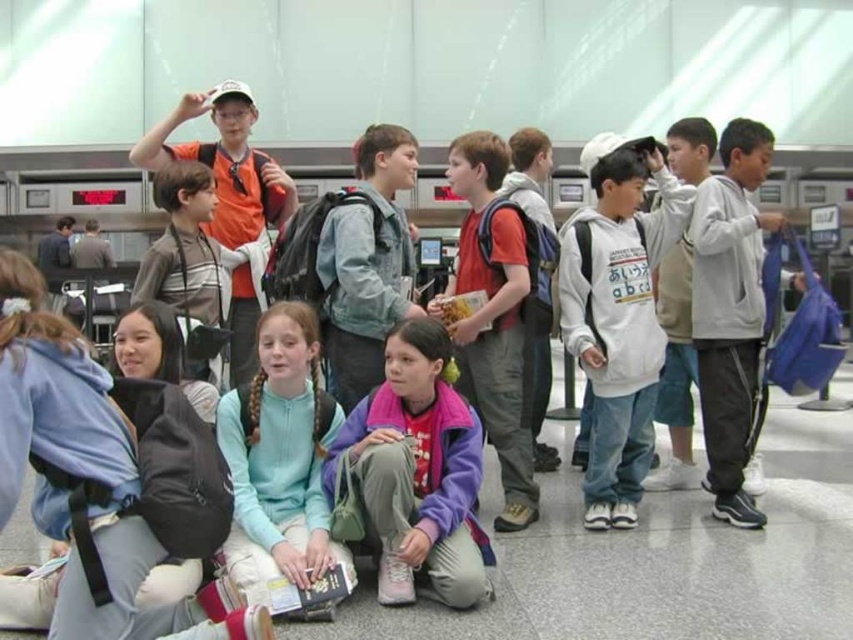
You are a parent looking for your child who is wearing a white cotton hoodie at center and a light blue fleece jacket at center. You see both items in the foreground. Which clothing item is covering the other?

The white cotton hoodie at center is positioned over the light blue fleece jacket at center, so the hoodie is covering the jacket.

You are a parent trying to locate your child who is wearing a white cotton hoodie at center. You see another child wearing a purple fleece jacket at center. How far apart are these two children?

The distance between the white cotton hoodie at center and the purple fleece jacket at center is 1.81 meters.

You are a parent trying to find your child who is wearing either the gray fleece hoodie at right or the denim jacket at center in the airport terminal. Based on the description, which jacket is wider?

The denim jacket at center is wider than the gray fleece hoodie at right because the gray fleece hoodie at right has a smaller width.